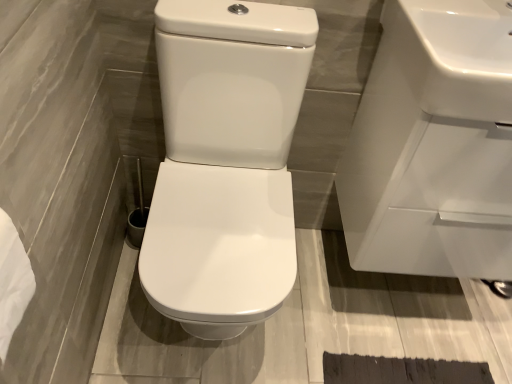
Question: From the image's perspective, relative to white glossy sink at upper right, placed as the first sink when sorted from front to back, is white glossy toilet at center above or below?

Choices:
 (A) below
 (B) above

Answer: (A)

Question: Considering the positions of white glossy toilet at center and white glossy sink at upper right, placed as the first sink when sorted from front to back, in the image, is white glossy toilet at center taller or shorter than white glossy sink at upper right, placed as the first sink when sorted from front to back,?

Choices:
 (A) short
 (B) tall

Answer: (B)

Question: Which object is the farthest from the white paper towel at lower left?

Choices:
 (A) white glossy sink at upper right, placed as the first sink when sorted from front to back
 (B) white glossy toilet at center
 (C) white glossy sink at upper right, positioned as the second sink in front-to-back order

Answer: (C)

Question: Which is farther from the white paper towel at lower left?

Choices:
 (A) white glossy toilet at center
 (B) white glossy sink at upper right, arranged as the first sink when viewed from the back
 (C) white glossy sink at upper right, placed as the first sink when sorted from front to back

Answer: (B)